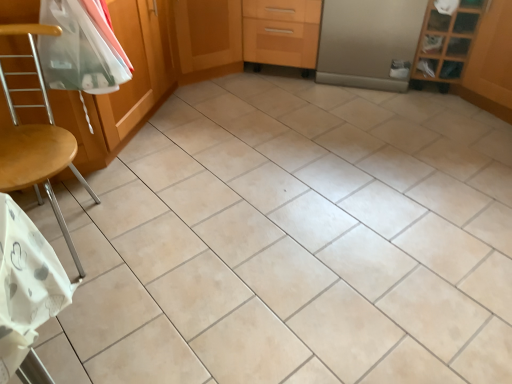
Question: Is wooden at left a part of satin silver refrigerator at center, the 1th screen door positioned from the right?

Choices:
 (A) yes
 (B) no

Answer: (B)

Question: Considering the relative sizes of satin silver refrigerator at center, the 1th screen door positioned from the right, and wooden at left in the image provided, is satin silver refrigerator at center, the 1th screen door positioned from the right, shorter than wooden at left?

Choices:
 (A) yes
 (B) no

Answer: (A)

Question: Is satin silver refrigerator at center, the 1th screen door positioned from the right, positioned with its back to wooden at left?

Choices:
 (A) no
 (B) yes

Answer: (A)

Question: Are satin silver refrigerator at center, which appears as the 2th screen door when viewed from the left, and wooden at left far apart?

Choices:
 (A) no
 (B) yes

Answer: (B)

Question: Could you tell me if satin silver refrigerator at center, which appears as the 2th screen door when viewed from the left, is facing wooden at left?

Choices:
 (A) yes
 (B) no

Answer: (B)

Question: Based on their sizes in the image, would you say wooden cabinet at center, which is the 2th screen door from right to left, is bigger or smaller than clear plastic bag at upper left?

Choices:
 (A) small
 (B) big

Answer: (B)

Question: Is wooden cabinet at center, which is the 1th screen door from left to right, wider or thinner than clear plastic bag at upper left?

Choices:
 (A) thin
 (B) wide

Answer: (B)

Question: From a real-world perspective, is wooden cabinet at center, which is the 2th screen door from right to left, physically located above or below clear plastic bag at upper left?

Choices:
 (A) below
 (B) above

Answer: (A)

Question: Considering their positions, is wooden cabinet at center, which is the 1th screen door from left to right, located in front of or behind clear plastic bag at upper left?

Choices:
 (A) front
 (B) behind

Answer: (B)

Question: Is clear plastic bag at upper left to the left or to the right of satin silver refrigerator at center, the 1th screen door positioned from the right, in the image?

Choices:
 (A) left
 (B) right

Answer: (A)

Question: Considering their positions, is clear plastic bag at upper left located in front of or behind satin silver refrigerator at center, which appears as the 2th screen door when viewed from the left?

Choices:
 (A) behind
 (B) front

Answer: (B)

Question: Looking at their shapes, would you say clear plastic bag at upper left is wider or thinner than satin silver refrigerator at center, which appears as the 2th screen door when viewed from the left?

Choices:
 (A) thin
 (B) wide

Answer: (A)

Question: Looking at the image, does clear plastic bag at upper left seem bigger or smaller compared to satin silver refrigerator at center, the 1th screen door positioned from the right?

Choices:
 (A) small
 (B) big

Answer: (A)

Question: From the image's perspective, is wooden at left located above or below wooden cabinet at center, which is the 1th screen door from left to right?

Choices:
 (A) above
 (B) below

Answer: (B)

Question: In terms of size, does wooden at left appear bigger or smaller than wooden cabinet at center, which is the 1th screen door from left to right?

Choices:
 (A) small
 (B) big

Answer: (A)